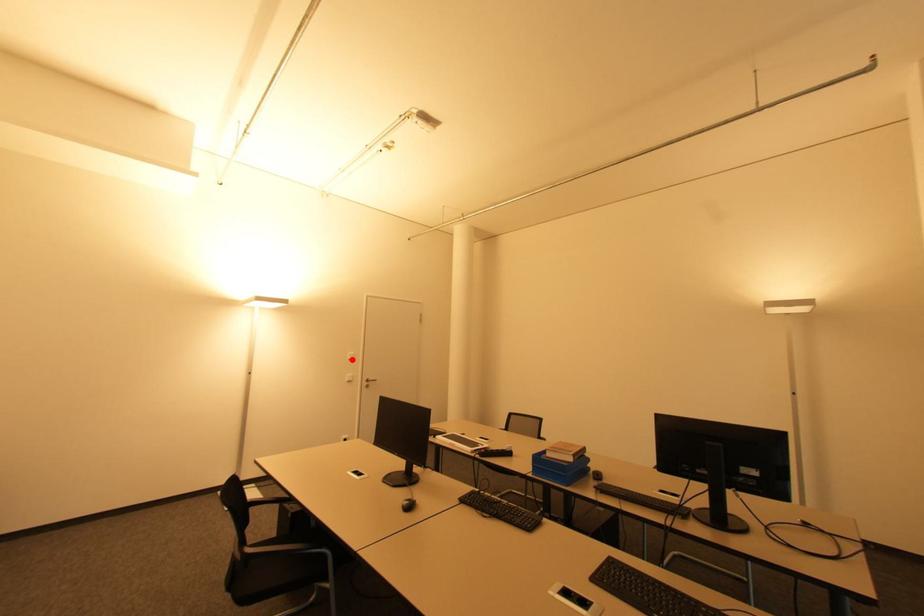
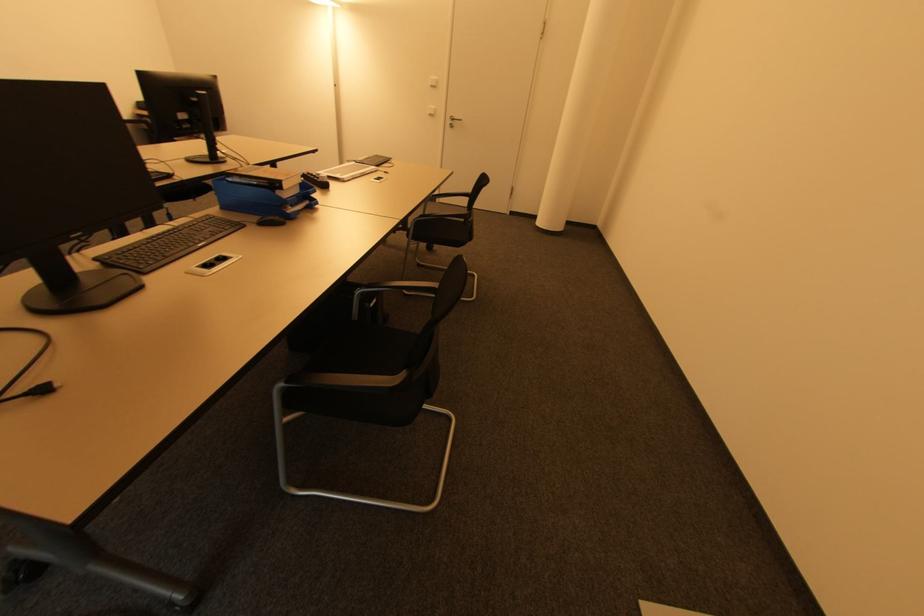
Where in the second image is the point corresponding to the highlighted location from the first image?

(434, 87)